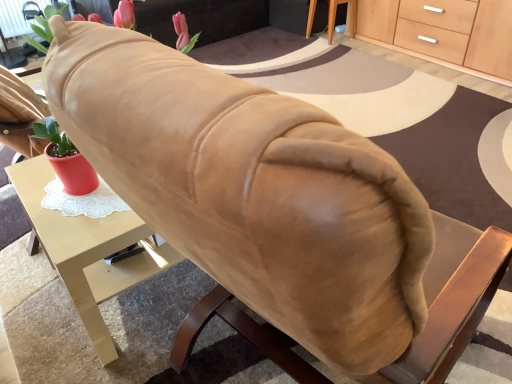
Question: Is light wood/wooden cabinet at upper right spatially inside wooden table at lower right, or outside of it?

Choices:
 (A) outside
 (B) inside

Answer: (A)

Question: From a real-world perspective, is light wood/wooden cabinet at upper right above or below wooden table at lower right?

Choices:
 (A) below
 (B) above

Answer: (B)

Question: Estimate the real-world distances between objects in this image. Which object is closer to the matte gold desk at center?

Choices:
 (A) wooden table at lower right
 (B) light wood/wooden cabinet at upper right
 (C) suede-like beige couch at upper center

Answer: (C)

Question: Estimate the real-world distances between objects in this image. Which object is farther from the wooden table at lower right?

Choices:
 (A) matte gold desk at center
 (B) suede-like beige couch at upper center
 (C) light wood/wooden cabinet at upper right

Answer: (A)